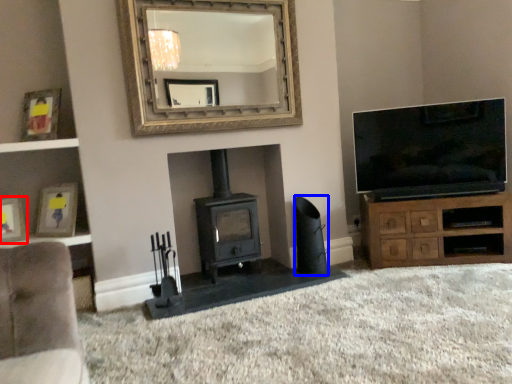
Question: Which object is closer to the camera taking this photo, picture frame (highlighted by a red box) or speaker (highlighted by a blue box)?

Choices:
 (A) picture frame
 (B) speaker

Answer: (A)